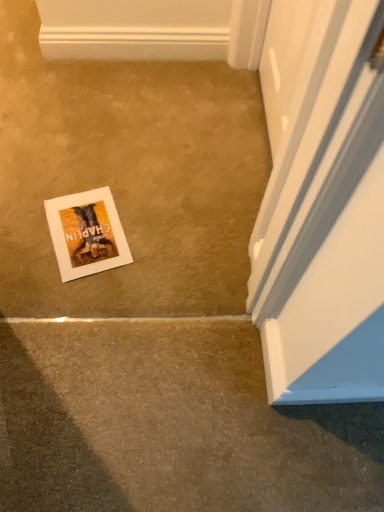
Image resolution: width=384 pixels, height=512 pixels. I want to click on free space in front of matte paper picture frame at center, so click(x=83, y=306).